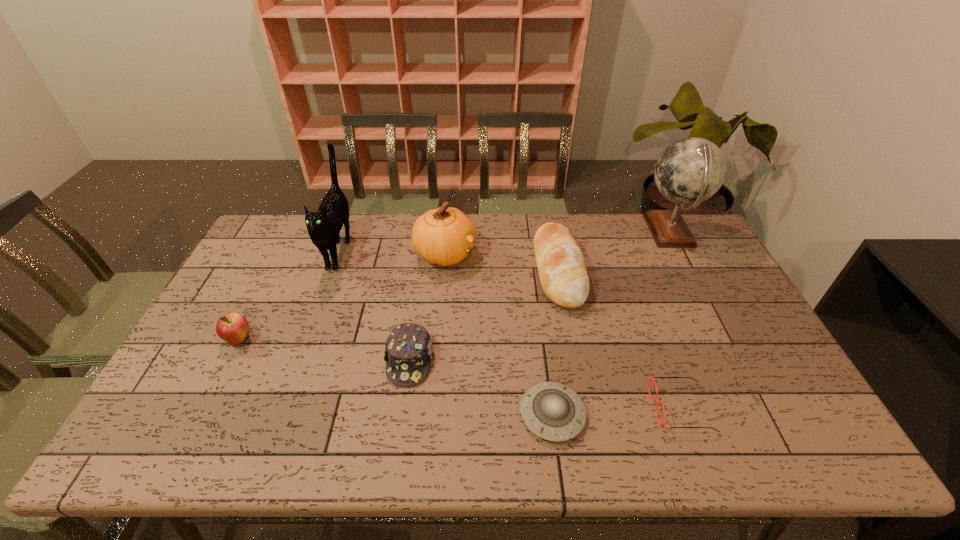
Image resolution: width=960 pixels, height=540 pixels. I want to click on vacant region located 0.280m on the back of the saucer, so click(x=538, y=306).

Locate an element on the screen. globe located in the far edge section of the desktop is located at coordinates (691, 170).

Locate an element on the screen. The width and height of the screenshot is (960, 540). cat at the far edge is located at coordinates (324, 226).

The height and width of the screenshot is (540, 960). In order to click on pumpkin at the far edge in this screenshot , I will do `click(444, 236)`.

Where is `bread that is at the far edge`? bread that is at the far edge is located at coordinates click(x=563, y=275).

At what (x,y) coordinates should I click in order to perform the action: click on spectacles that is at the near edge. Please return your answer as a coordinate pair (x, y). Looking at the image, I should click on (650, 378).

Locate an element on the screen. saucer that is at the near edge is located at coordinates (552, 411).

You are a GUI agent. You are given a task and a screenshot of the screen. Output one action in this format:
    pyautogui.click(x=<x>, y=<y>)
    Task: Click on the object located in the left edge section of the desktop
    
    Given the screenshot: What is the action you would take?
    pyautogui.click(x=232, y=327)

The image size is (960, 540). In order to click on object located in the right edge section of the desktop in this screenshot , I will do `click(691, 170)`.

At what (x,y) coordinates should I click in order to perform the action: click on object located at the far right corner. Please return your answer as a coordinate pair (x, y). Looking at the image, I should click on (x=691, y=170).